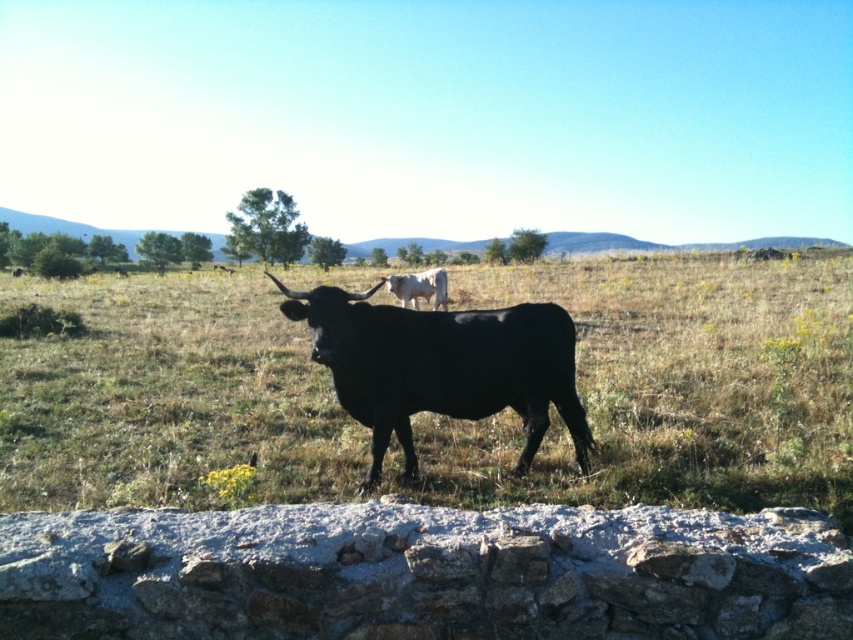
Question: Which of the following is the closest to the observer?

Choices:
 (A) white smooth cow at center
 (B) black glossy bull at center

Answer: (B)

Question: Does green grass at center have a lesser width compared to black glossy bull at center?

Choices:
 (A) no
 (B) yes

Answer: (A)

Question: Estimate the real-world distances between objects in this image. Which object is closer to the black glossy bull at center?

Choices:
 (A) white smooth cow at center
 (B) green grass at center

Answer: (A)

Question: Which object is the closest to the white smooth cow at center?

Choices:
 (A) green grass at center
 (B) black glossy bull at center

Answer: (A)

Question: Is green grass at center to the right of white smooth cow at center from the viewer's perspective?

Choices:
 (A) yes
 (B) no

Answer: (A)

Question: Where is black glossy bull at center located in relation to white smooth cow at center in the image?

Choices:
 (A) left
 (B) right

Answer: (B)